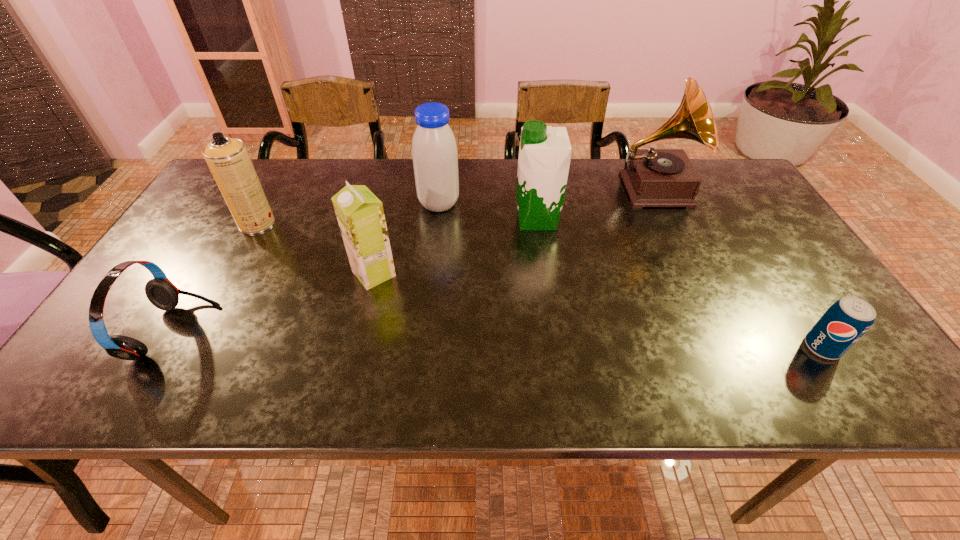
Where is `free space that satisfies the following two spatial constraints: 1. on the front side of the aerosol can; 2. with the microphone attached to the side of the headset`? The image size is (960, 540). free space that satisfies the following two spatial constraints: 1. on the front side of the aerosol can; 2. with the microphone attached to the side of the headset is located at coordinates (197, 332).

Locate an element on the screen. The width and height of the screenshot is (960, 540). vacant region that satisfies the following two spatial constraints: 1. on the front side of the third nearest object; 2. with the microphone attached to the side of the second shortest object is located at coordinates (360, 332).

Where is `free space that satisfies the following two spatial constraints: 1. on the front side of the second soya milk from left to right; 2. with the microphone attached to the side of the second shortest object`? Image resolution: width=960 pixels, height=540 pixels. free space that satisfies the following two spatial constraints: 1. on the front side of the second soya milk from left to right; 2. with the microphone attached to the side of the second shortest object is located at coordinates (425, 332).